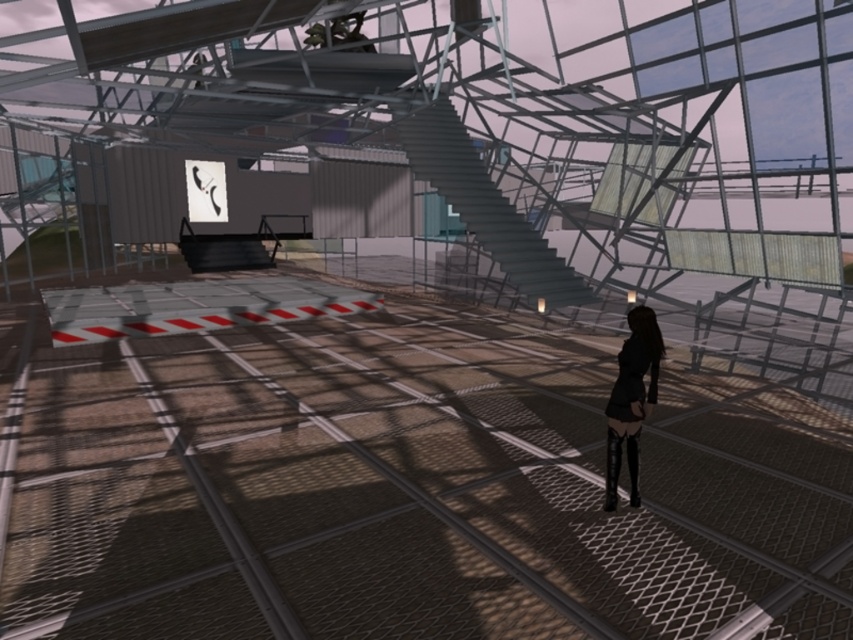
You are a drone operator controlling a drone that needs to fly from point A to point B. The coordinates of point A are point (421, 128) and point B are point (625, 433). Given that the drone can only move forward and backward along the line connecting these two points, which direction should the drone move to reach point B from point A?

The drone should move backward to reach point B from point A because point A is further to the camera than point B, so moving backward along the line would bring it closer to point B.

You are standing at the entrance of the industrial space and see the metallic gray staircase at center. If you want to reach the staircase, which direction should you walk relative to your current position?

The metallic gray staircase at center is located at point 0.322 on the x and 0.570 on the y coordinate. Since you are at the entrance, you should walk towards the center of the room to reach it.

You are a security guard in this futuristic space. You need to check the restricted area marked by red and white barriers. You are currently standing at the metallic gray staircase at center. Which direction should you move to reach the black leather dress at lower right first?

Since the metallic gray staircase at center is closer to you than the black leather dress at lower right, you should move towards the black leather dress at lower right by going around or past the staircase.